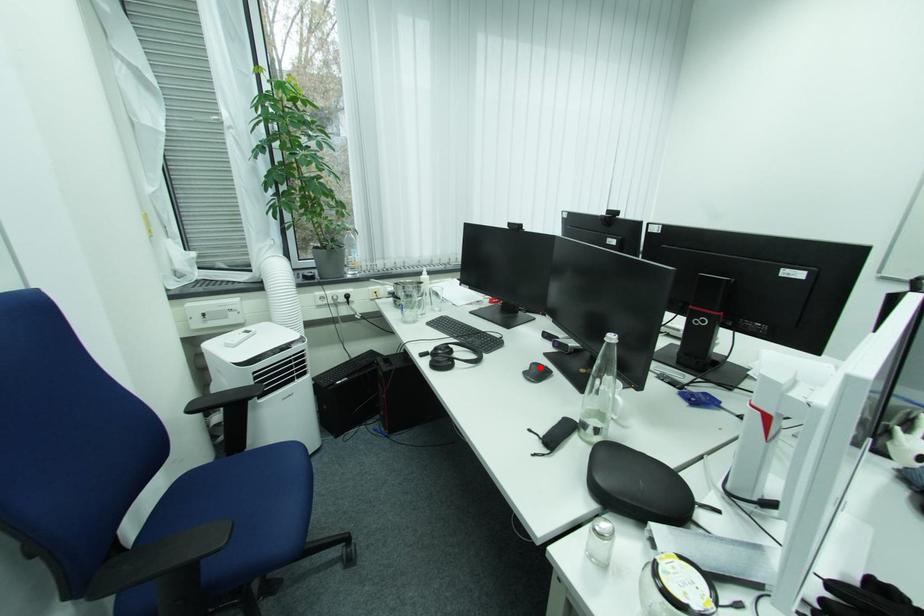
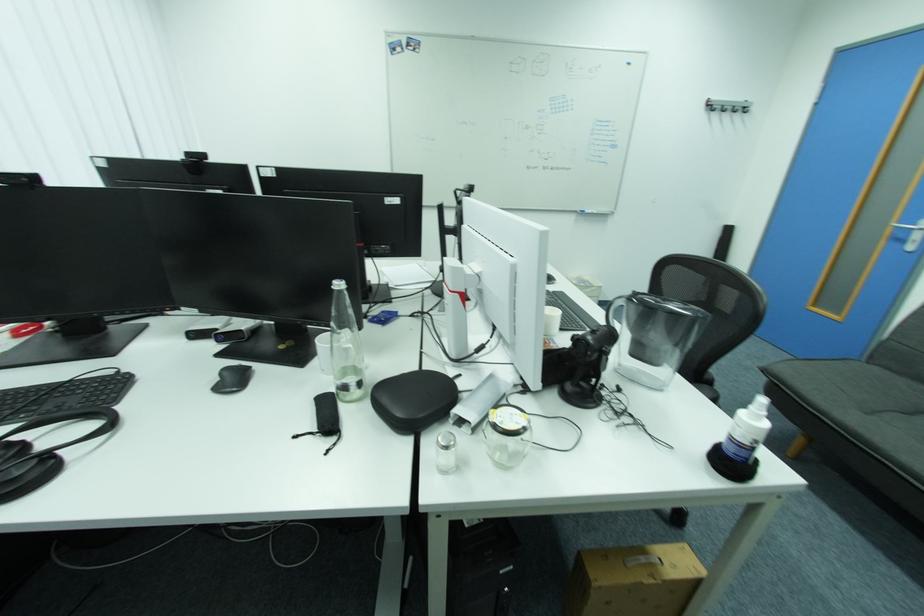
Where in the second image is the point corresponding to the highlighted location from the first image?

(232, 375)